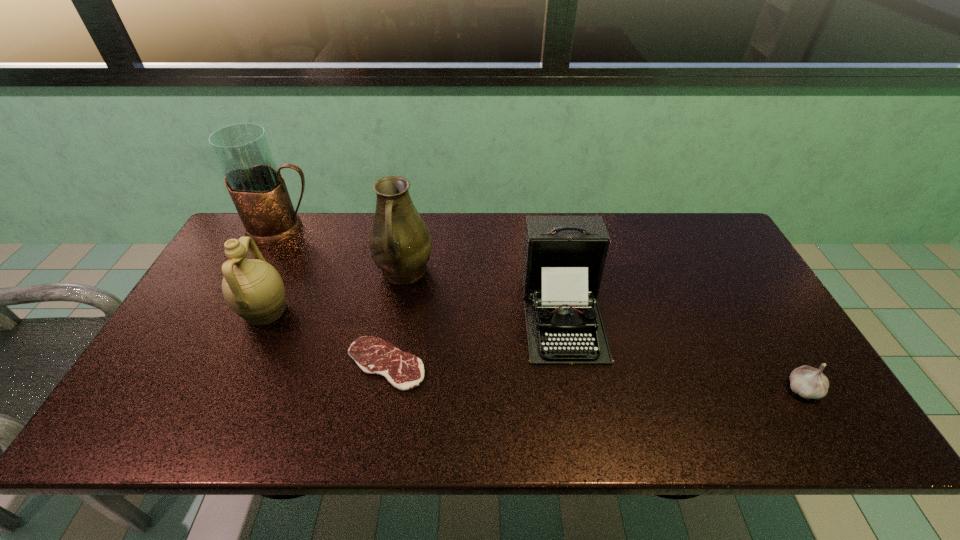
You are a GUI agent. You are given a task and a screenshot of the screen. Output one action in this format:
    pyautogui.click(x=<x>, y=<y>)
    Task: Click on the farthest pitcher
    The image size is (960, 540).
    Given the screenshot: What is the action you would take?
    pyautogui.click(x=257, y=188)

This screenshot has width=960, height=540. What are the coordinates of `the rightmost pitcher` in the screenshot? It's located at (400, 243).

Find the location of a particular element. The height and width of the screenshot is (540, 960). the second tallest pitcher is located at coordinates (400, 243).

The height and width of the screenshot is (540, 960). I want to click on the shortest pitcher, so click(253, 288).

Where is `the second object from right to left`? The width and height of the screenshot is (960, 540). the second object from right to left is located at coordinates (563, 261).

Where is `garlic`? garlic is located at coordinates (808, 382).

At what (x,y) coordinates should I click in order to perform the action: click on the rightmost object. Please return your answer as a coordinate pair (x, y). The width and height of the screenshot is (960, 540). Looking at the image, I should click on (808, 382).

Identify the location of the shortest object. (405, 371).

The height and width of the screenshot is (540, 960). I want to click on vacant space located with the handle on the side of the farthest object, so click(391, 230).

This screenshot has height=540, width=960. What are the coordinates of `vacant region located 0.390m on the handle side of the rightmost pitcher` in the screenshot? It's located at (376, 423).